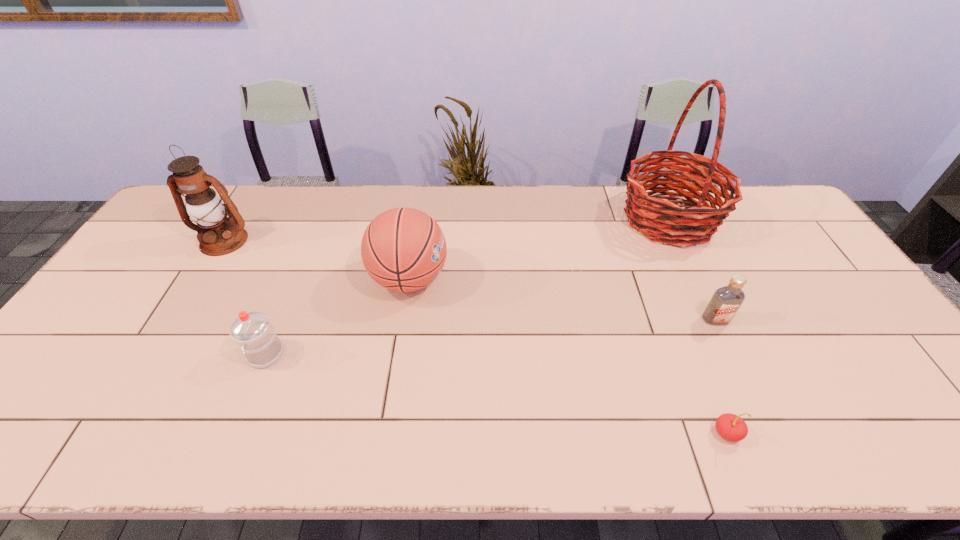
Where is `free space that is in between the vodka and the cherry`? The height and width of the screenshot is (540, 960). free space that is in between the vodka and the cherry is located at coordinates (721, 376).

Locate an element on the screen. The image size is (960, 540). vacant area that lies between the fifth farthest object and the third object from left to right is located at coordinates (338, 316).

Where is `free space between the basketball and the nearest object`? free space between the basketball and the nearest object is located at coordinates (568, 356).

Where is `vacant region between the second nearest object and the vodka`? The image size is (960, 540). vacant region between the second nearest object and the vodka is located at coordinates (491, 337).

Identify the location of vacant area between the basket and the water bottle. This screenshot has width=960, height=540. (468, 287).

Find the location of a particular element. The width and height of the screenshot is (960, 540). free point between the leftmost object and the vodka is located at coordinates coord(469,280).

Locate an element on the screen. The image size is (960, 540). empty location between the leftmost object and the nearest object is located at coordinates (475, 337).

In order to click on object that stands as the third closest to the fourth farthest object in this screenshot , I will do `click(403, 249)`.

Locate an element on the screen. object that is the fourth closest to the fourth farthest object is located at coordinates (253, 332).

The height and width of the screenshot is (540, 960). What are the coordinates of `vacant space that satisfies the following two spatial constraints: 1. on the handle side of the cherry; 2. on the right side of the fifth farthest object` in the screenshot? It's located at (234, 433).